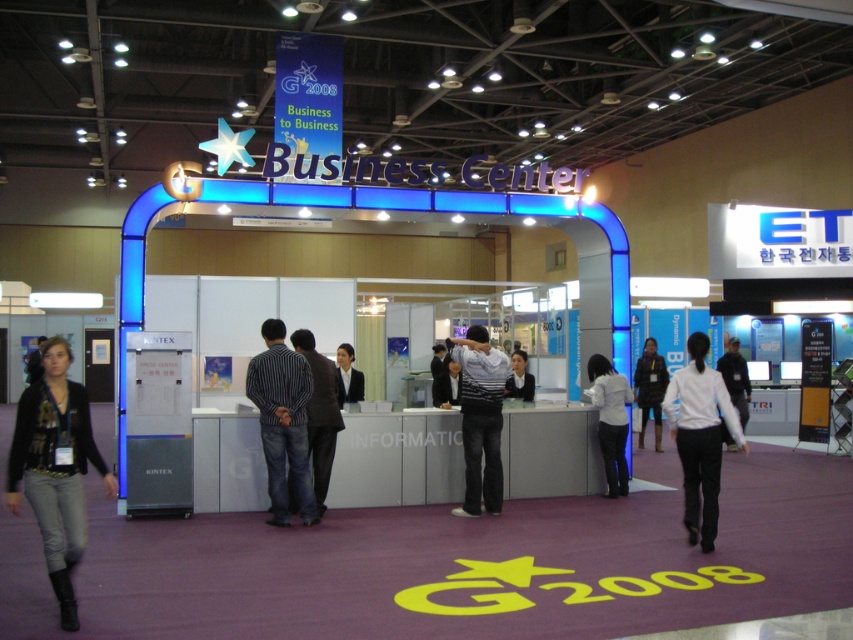
You are at the G2008 Business to Business section and need to reach the registration desk located at point (339, 376). There is an obstacle at point (608, 396). Can you walk directly to the registration desk without going around the obstacle?

Point (608, 396) is behind point (339, 376), so you can walk directly to the registration desk at point (339, 376) without needing to go around the obstacle at point (608, 396) since it is positioned behind the target location.